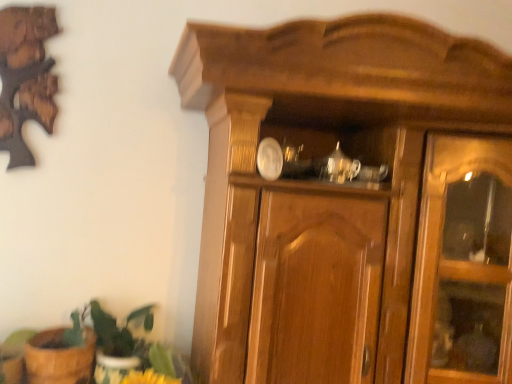
Question: Considering the relative sizes of green leafy plant at lower left and brown woven basket at lower left in the image provided, is green leafy plant at lower left taller than brown woven basket at lower left?

Choices:
 (A) no
 (B) yes

Answer: (B)

Question: Considering the relative sizes of green leafy plant at lower left and brown woven basket at lower left in the image provided, is green leafy plant at lower left wider than brown woven basket at lower left?

Choices:
 (A) yes
 (B) no

Answer: (A)

Question: Can you confirm if green leafy plant at lower left is positioned to the left of brown woven basket at lower left?

Choices:
 (A) no
 (B) yes

Answer: (A)

Question: Is green leafy plant at lower left closer to the viewer compared to brown woven basket at lower left?

Choices:
 (A) yes
 (B) no

Answer: (B)

Question: Is brown woven basket at lower left at the back of green leafy plant at lower left?

Choices:
 (A) yes
 (B) no

Answer: (B)

Question: Is green leafy plant at lower left positioned beyond the bounds of brown woven basket at lower left?

Choices:
 (A) yes
 (B) no

Answer: (A)

Question: Is brown woven basket at lower left looking in the opposite direction of green leafy plant at lower left?

Choices:
 (A) no
 (B) yes

Answer: (A)

Question: Does brown woven basket at lower left have a larger size compared to green leafy plant at lower left?

Choices:
 (A) no
 (B) yes

Answer: (A)

Question: Is brown woven basket at lower left directly adjacent to green leafy plant at lower left?

Choices:
 (A) yes
 (B) no

Answer: (A)

Question: Does brown woven basket at lower left have a greater height compared to green leafy plant at lower left?

Choices:
 (A) yes
 (B) no

Answer: (B)

Question: Is brown woven basket at lower left closer to camera compared to green leafy plant at lower left?

Choices:
 (A) yes
 (B) no

Answer: (A)

Question: From the image's perspective, is brown woven basket at lower left located above green leafy plant at lower left?

Choices:
 (A) no
 (B) yes

Answer: (A)

Question: Relative to brown woven basket at lower left, is green leafy plant at lower left in front or behind?

Choices:
 (A) front
 (B) behind

Answer: (B)